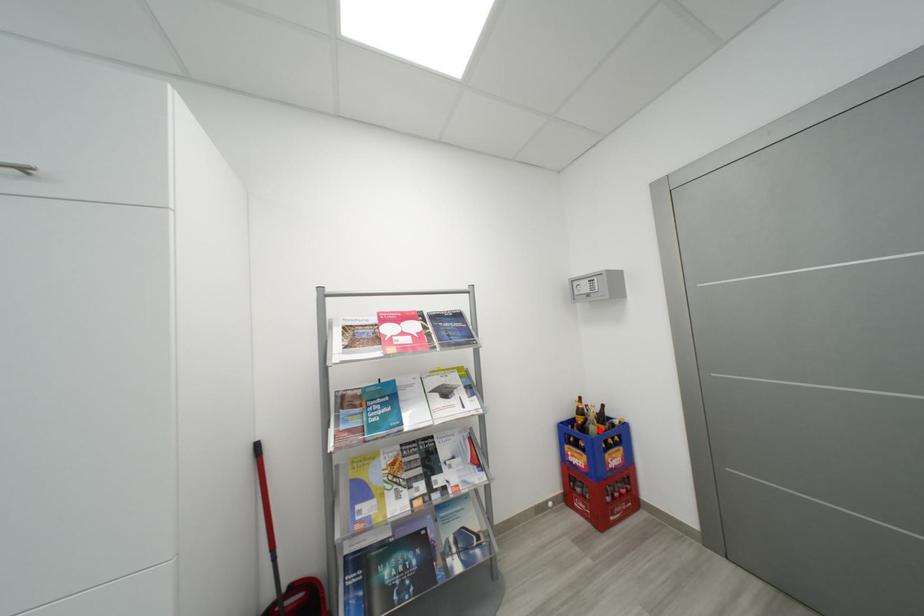
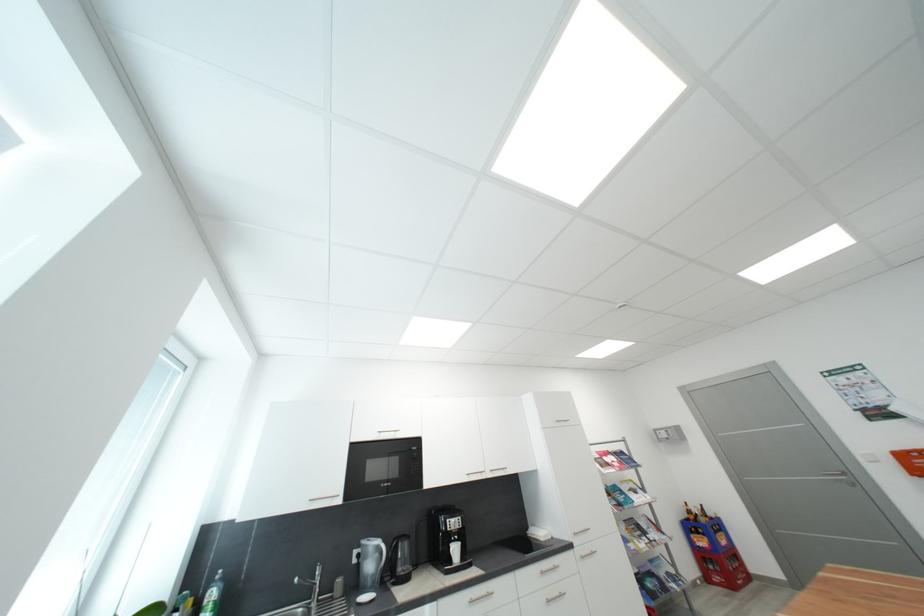
Where in the second image is the point corresponding to the highlighted location from the first image?

(710, 522)